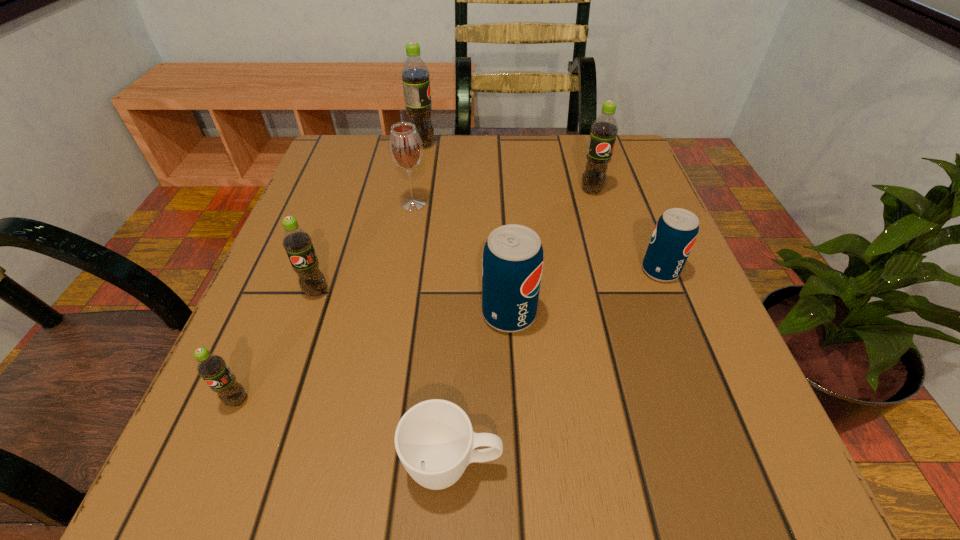
Where is `vacant space at the far right corner of the desktop`? vacant space at the far right corner of the desktop is located at coordinates (636, 188).

Where is `free space between the leftmost green soda and the wineglass`? This screenshot has width=960, height=540. free space between the leftmost green soda and the wineglass is located at coordinates (325, 302).

The height and width of the screenshot is (540, 960). What are the coordinates of `vacant space in between the nearest soda and the second object from right to left` in the screenshot? It's located at (415, 295).

Identify the location of free space between the leftmost object and the wineglass. (325, 302).

Identify the location of free space between the wineglass and the second farthest soda. This screenshot has height=540, width=960. (502, 197).

You are a GUI agent. You are given a task and a screenshot of the screen. Output one action in this format:
    pyautogui.click(x=<x>, y=<y>)
    Task: Click on the free space between the rightmost soda and the nearer blue pop
    
    Given the screenshot: What is the action you would take?
    pyautogui.click(x=585, y=292)

You are a GUI agent. You are given a task and a screenshot of the screen. Output one action in this format:
    pyautogui.click(x=<x>, y=<y>)
    Task: Click on the empty location between the left blue pop and the smallest green soda
    
    Given the screenshot: What is the action you would take?
    pyautogui.click(x=373, y=357)

Find the location of a particular element. This screenshot has width=960, height=540. free area in between the red wineglass and the second nearest object is located at coordinates (325, 302).

Find the location of a particular element. free spot between the fourth soda from right to left and the red wineglass is located at coordinates (418, 174).

Where is `object that stands as the sixth closest to the second green soda from left to right`? object that stands as the sixth closest to the second green soda from left to right is located at coordinates (604, 129).